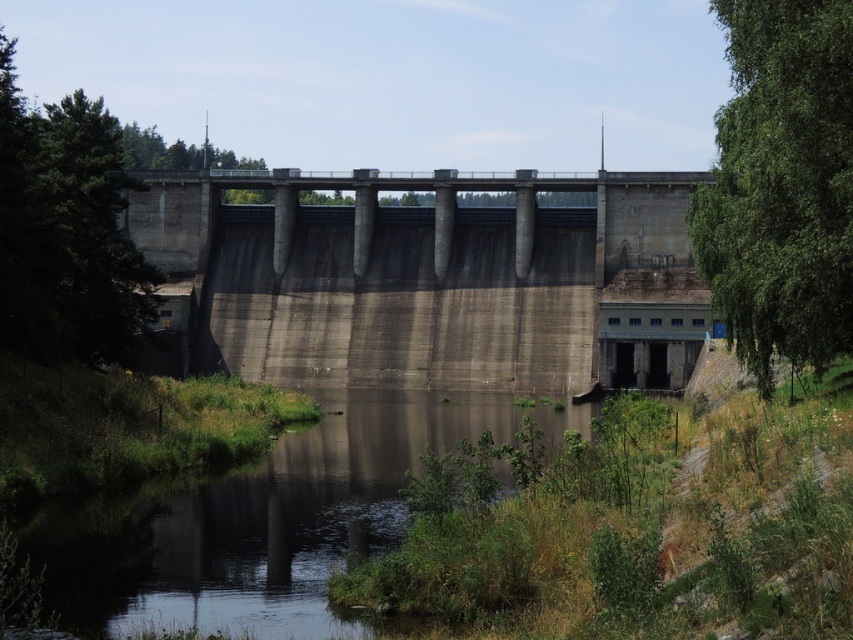
Consider the image. Can you confirm if gray concrete dam at center is positioned to the right of green leafy tree at right?

Incorrect, gray concrete dam at center is not on the right side of green leafy tree at right.

From the picture: Who is more forward, (248,344) or (804,88)?

Point (804,88) is more forward.

Find the location of `gray concrete dam at center`. gray concrete dam at center is located at coordinates (433, 280).

Where is `gray concrete dam at center`? gray concrete dam at center is located at coordinates (433, 280).

Can you confirm if green leafy tree at right is positioned to the left of green leafy tree at left?

In fact, green leafy tree at right is to the right of green leafy tree at left.

Who is taller, green leafy tree at right or green leafy tree at left?

Standing taller between the two is green leafy tree at left.

Is point (717, 259) less distant than point (39, 124)?

Yes, it is in front of point (39, 124).

Identify the location of green leafy tree at right. coord(781,184).

Based on the photo, which is below, green grassy river at center or green leafy tree at right?

Positioned lower is green grassy river at center.

Is green grassy river at center to the left of green leafy tree at right from the viewer's perspective?

Indeed, green grassy river at center is positioned on the left side of green leafy tree at right.

At what (x,y) coordinates should I click in order to perform the action: click on green grassy river at center. Please return your answer as a coordinate pair (x, y). Looking at the image, I should click on (263, 522).